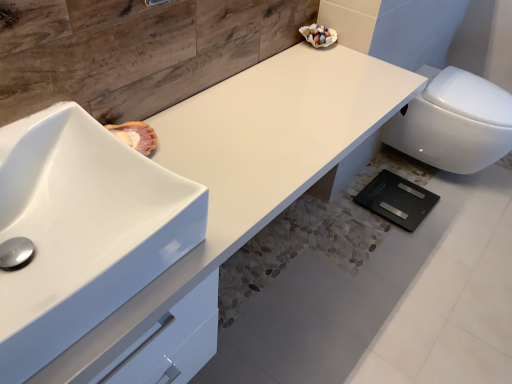
Question: Is white glossy sink at left oriented away from white glossy toilet at lower right?

Choices:
 (A) no
 (B) yes

Answer: (A)

Question: Is white glossy sink at left in contact with white glossy toilet at lower right?

Choices:
 (A) yes
 (B) no

Answer: (B)

Question: Considering the relative sizes of white glossy sink at left and white glossy toilet at lower right in the image provided, is white glossy sink at left smaller than white glossy toilet at lower right?

Choices:
 (A) no
 (B) yes

Answer: (B)

Question: Is white glossy sink at left in front of white glossy toilet at lower right?

Choices:
 (A) yes
 (B) no

Answer: (A)

Question: Can you confirm if white glossy sink at left is taller than white glossy toilet at lower right?

Choices:
 (A) yes
 (B) no

Answer: (B)

Question: Is white glossy sink at left outside white glossy toilet at lower right?

Choices:
 (A) yes
 (B) no

Answer: (A)

Question: Is white glossy sink at left inside white glossy toilet at lower right?

Choices:
 (A) yes
 (B) no

Answer: (B)

Question: Considering the relative positions of white glossy toilet at lower right and white glossy sink at left in the image provided, is white glossy toilet at lower right behind white glossy sink at left?

Choices:
 (A) yes
 (B) no

Answer: (A)

Question: Can you see white glossy toilet at lower right touching white glossy sink at left?

Choices:
 (A) no
 (B) yes

Answer: (A)

Question: From the image's perspective, is white glossy toilet at lower right located beneath white glossy sink at left?

Choices:
 (A) no
 (B) yes

Answer: (A)

Question: Is white glossy toilet at lower right oriented towards white glossy sink at left?

Choices:
 (A) yes
 (B) no

Answer: (B)

Question: Is white glossy toilet at lower right not within white glossy sink at left?

Choices:
 (A) yes
 (B) no

Answer: (A)

Question: Could you tell me if white glossy sink at left is facing white glossy counter top at center?

Choices:
 (A) no
 (B) yes

Answer: (A)